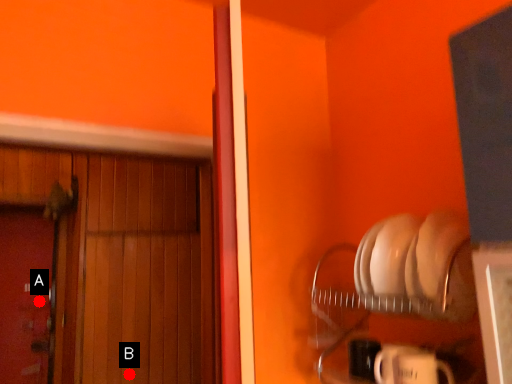
Question: Two points are circled on the image, labeled by A and B beside each circle. Which point is closer to the camera?

Choices:
 (A) A is closer
 (B) B is closer

Answer: (B)